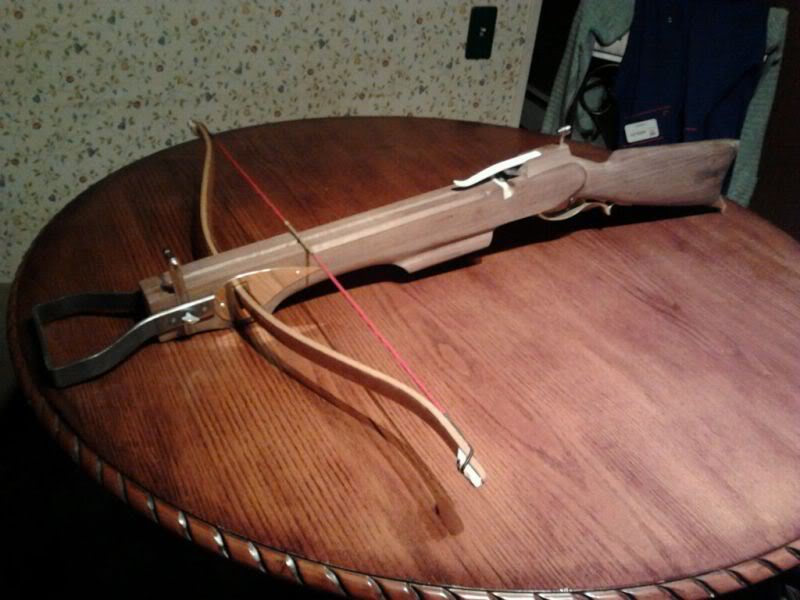
Find the location of a particular element. Image resolution: width=800 pixels, height=600 pixels. wood table is located at coordinates (593, 374).